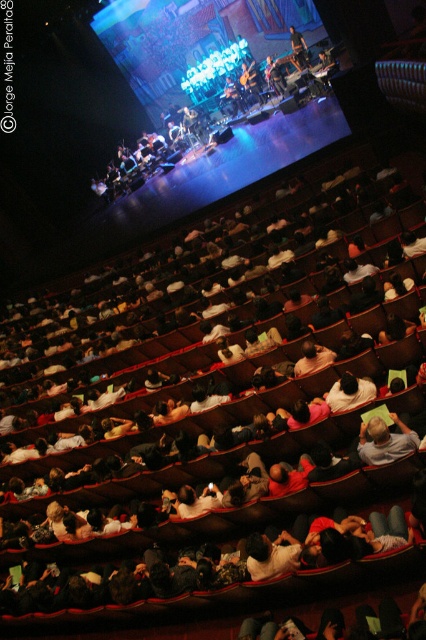
Question: Is dark gray fabric seat at center wider than light brown fabric shirt at lower right?

Choices:
 (A) no
 (B) yes

Answer: (A)

Question: Which object appears closest to the camera in this image?

Choices:
 (A) dark gray fabric seat at center
 (B) shiny blue jacket at center
 (C) light brown fabric shirt at lower right

Answer: (C)

Question: Which object is the farthest from the shiny blue jacket at center?

Choices:
 (A) light brown fabric shirt at lower right
 (B) dark gray fabric seat at center

Answer: (A)

Question: Where is dark gray fabric seat at center located in relation to light brown fabric shirt at lower right in the image?

Choices:
 (A) above
 (B) below

Answer: (B)

Question: Does light brown fabric shirt at lower right appear over shiny blue jacket at center?

Choices:
 (A) yes
 (B) no

Answer: (B)

Question: Based on their relative distances, which object is farther from the light brown fabric shirt at lower right?

Choices:
 (A) dark gray fabric seat at center
 (B) shiny blue jacket at center

Answer: (B)